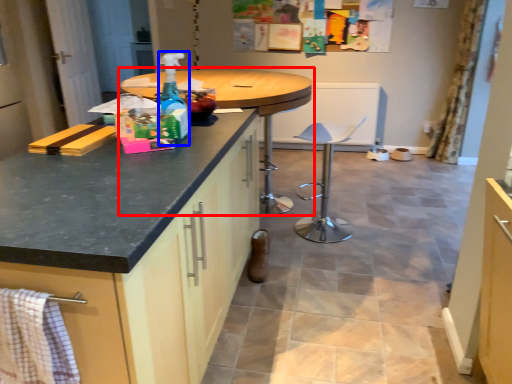
Question: Among these objects, which one is farthest to the camera, table (highlighted by a red box) or bottle (highlighted by a blue box)?

Choices:
 (A) table
 (B) bottle

Answer: (A)